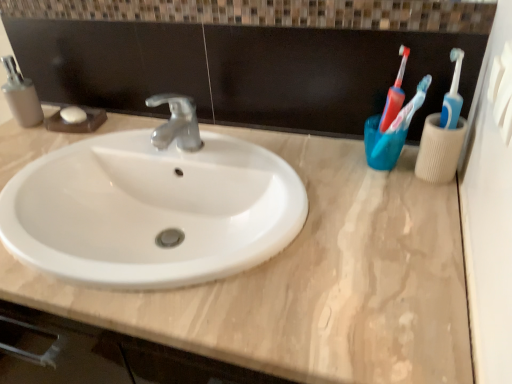
Question: Is there a large distance between beige marble counter top at center and translucent blue toothbrush at upper right?

Choices:
 (A) yes
 (B) no

Answer: (B)

Question: Is beige marble counter top at center looking in the opposite direction of translucent blue toothbrush at upper right?

Choices:
 (A) yes
 (B) no

Answer: (B)

Question: Is beige marble counter top at center taller than translucent blue toothbrush at upper right?

Choices:
 (A) yes
 (B) no

Answer: (B)

Question: Would you say beige marble counter top at center contains translucent blue toothbrush at upper right?

Choices:
 (A) yes
 (B) no

Answer: (B)

Question: From the image's perspective, is beige marble counter top at center located beneath translucent blue toothbrush at upper right?

Choices:
 (A) no
 (B) yes

Answer: (B)

Question: Is point (306, 327) positioned closer to the camera than point (5, 61)?

Choices:
 (A) closer
 (B) farther

Answer: (A)

Question: Is beige marble counter top at center in front of or behind matte gray soap dispenser at left in the image?

Choices:
 (A) behind
 (B) front

Answer: (B)

Question: Is beige marble counter top at center taller or shorter than matte gray soap dispenser at left?

Choices:
 (A) short
 (B) tall

Answer: (A)

Question: In the image, is beige marble counter top at center on the left side or the right side of matte gray soap dispenser at left?

Choices:
 (A) right
 (B) left

Answer: (A)

Question: In the image, is translucent blue toothbrush at upper right positioned in front of or behind matte gray soap dispenser at left?

Choices:
 (A) behind
 (B) front

Answer: (B)

Question: Is translucent blue toothbrush at upper right inside or outside of matte gray soap dispenser at left?

Choices:
 (A) inside
 (B) outside

Answer: (B)

Question: Considering the positions of translucent blue toothbrush at upper right and matte gray soap dispenser at left in the image, is translucent blue toothbrush at upper right taller or shorter than matte gray soap dispenser at left?

Choices:
 (A) short
 (B) tall

Answer: (B)

Question: From the image's perspective, is translucent blue toothbrush at upper right located above or below matte gray soap dispenser at left?

Choices:
 (A) below
 (B) above

Answer: (A)

Question: Is point pos(14,94) positioned closer to the camera than point pos(431,258)?

Choices:
 (A) closer
 (B) farther

Answer: (B)

Question: From the image's perspective, is matte gray soap dispenser at left located above or below beige marble counter top at center?

Choices:
 (A) above
 (B) below

Answer: (A)